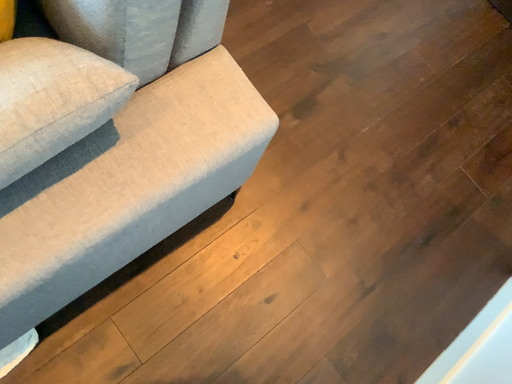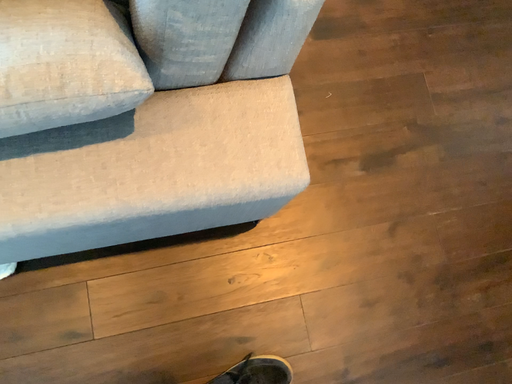
Question: Which way did the camera rotate in the video?

Choices:
 (A) rotated right
 (B) rotated left

Answer: (B)